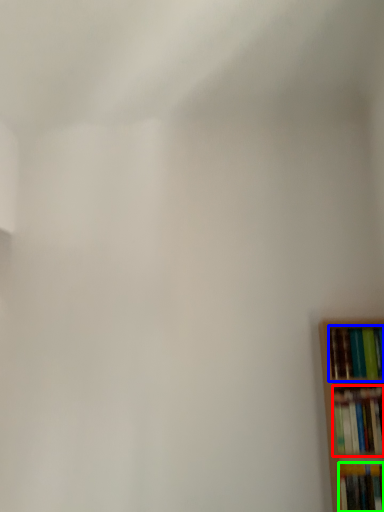
Question: Based on their relative distances, which object is nearer to book (highlighted by a red box)? Choose from book (highlighted by a blue box) and book (highlighted by a green box).

Choices:
 (A) book
 (B) book

Answer: (B)